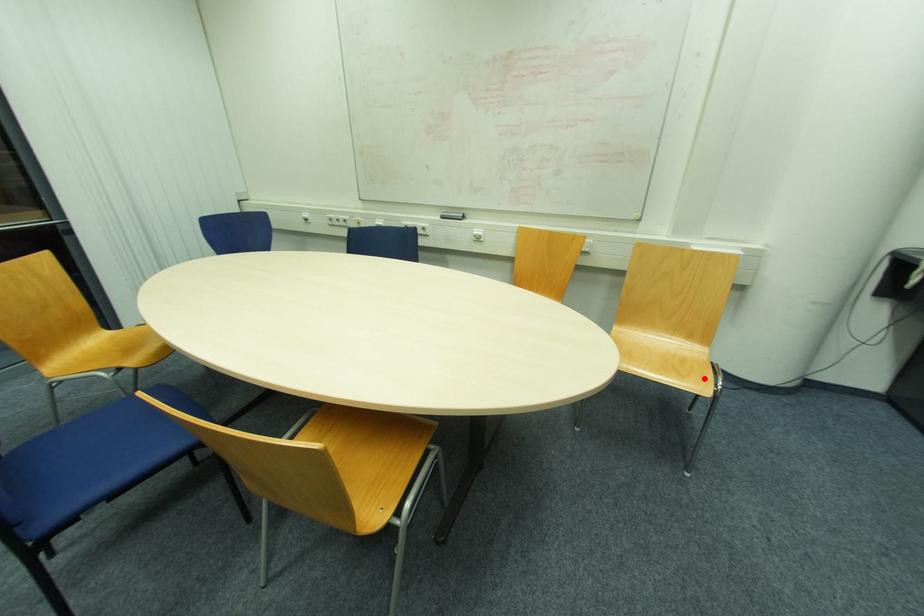
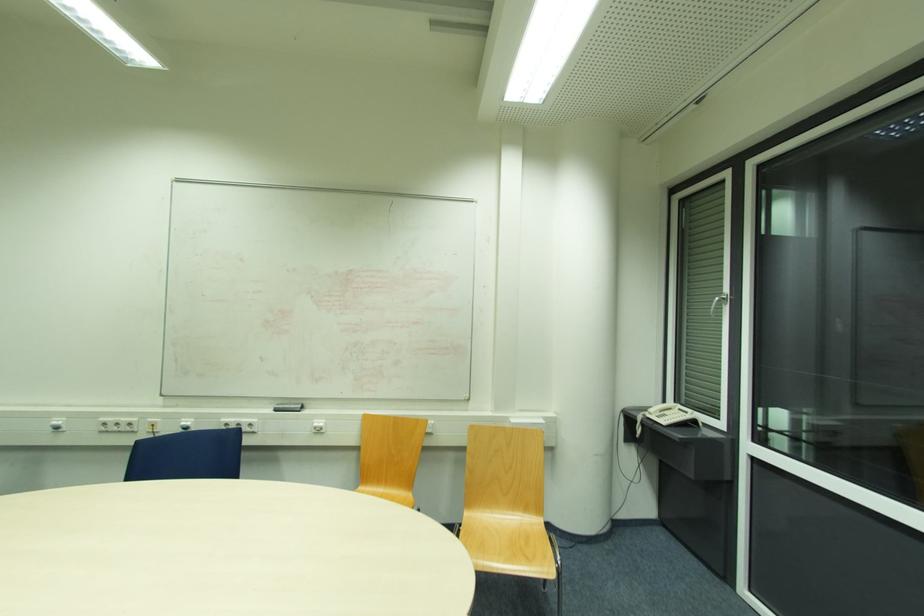
Question: I am providing you with two images of the same scene from different viewpoints. A red point is shown in image1. For the corresponding object point in image2, is it positioned nearer or farther from the camera?

Choices:
 (A) Nearer
 (B) Farther

Answer: (A)